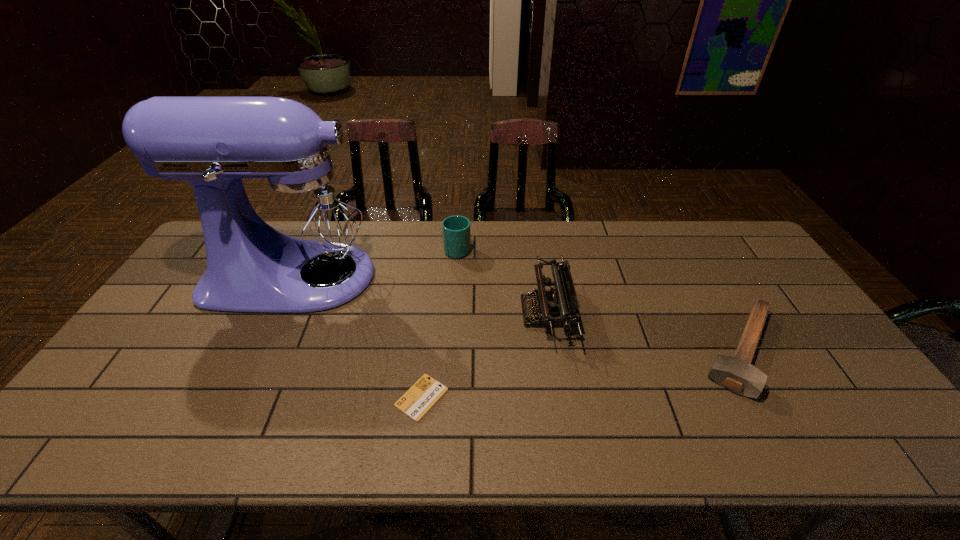
Image resolution: width=960 pixels, height=540 pixels. Identify the location of vacant space that satisfies the following two spatial constraints: 1. at the mixing area of the rightmost object; 2. on the right side of the mixer. (261, 350).